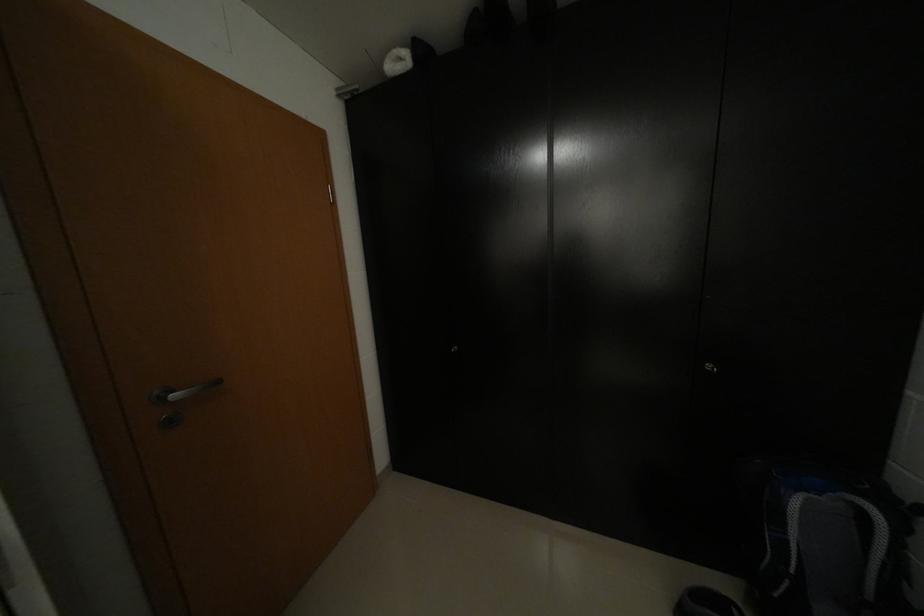
The height and width of the screenshot is (616, 924). Identify the location of white paper roll. (396, 62).